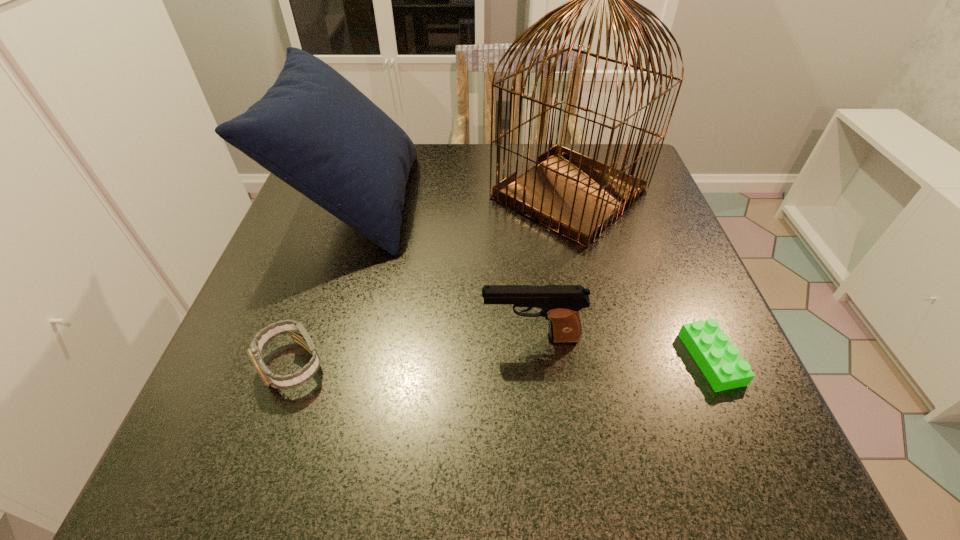
Image resolution: width=960 pixels, height=540 pixels. I want to click on free spot that satisfies the following two spatial constraints: 1. on the front side of the birdcage; 2. at the barrel of the pistol, so click(603, 338).

Where is `free space that satisfies the following two spatial constraints: 1. on the facing side of the cushion; 2. on the left side of the Lego`? free space that satisfies the following two spatial constraints: 1. on the facing side of the cushion; 2. on the left side of the Lego is located at coordinates (302, 359).

In order to click on free space that satisfies the following two spatial constraints: 1. on the front side of the Lego; 2. on the left side of the birdcage in this screenshot , I will do `click(608, 359)`.

Image resolution: width=960 pixels, height=540 pixels. I want to click on free space in the image that satisfies the following two spatial constraints: 1. on the back side of the shortest object; 2. on the facing side of the fourth shortest object, so click(x=643, y=201).

The height and width of the screenshot is (540, 960). I want to click on free space in the image that satisfies the following two spatial constraints: 1. at the barrel of the pistol; 2. on the face of the second shortest object, so click(x=533, y=365).